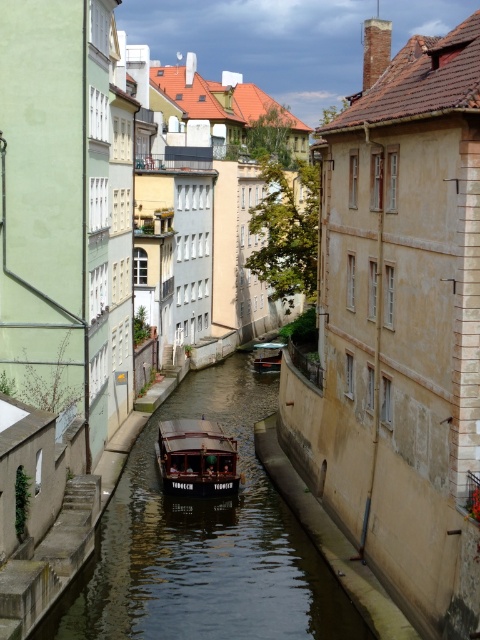
You are a tourist standing on the canal bridge. You see the smooth dark water at center and the wooden boat at center. Which object is wider from your perspective?

The smooth dark water at center is wider than the wooden boat at center.

You are standing on the canal bridge and see the smooth dark water at center and the wooden polished boat at center. Which object is positioned to the left?

The smooth dark water at center is positioned to the left of the wooden polished boat at center.

You are standing on the left side of the wooden boat at center in the canal scene. Which direction should you look to see the smooth dark water at center?

The smooth dark water at center is to the left of the wooden boat at center, so you should look to your left to see it.